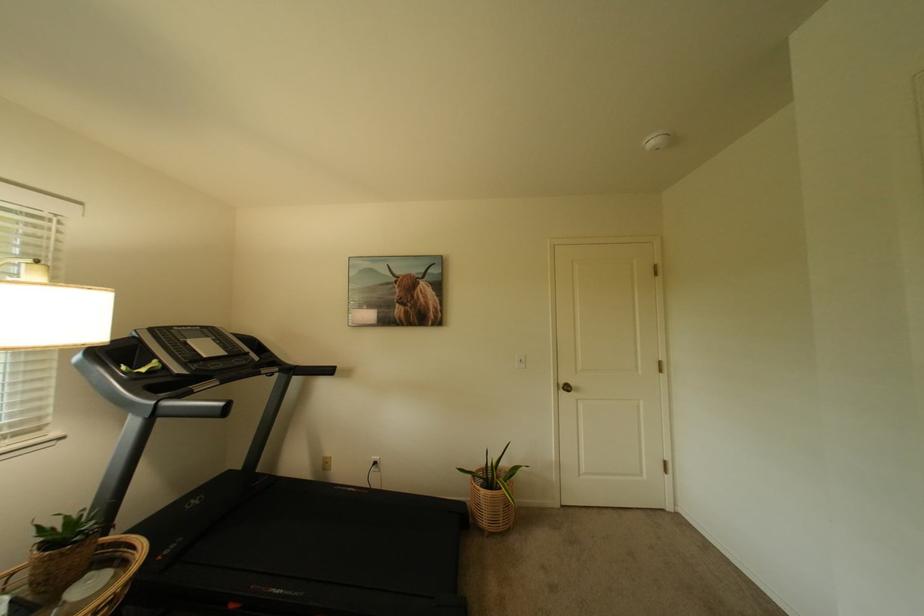
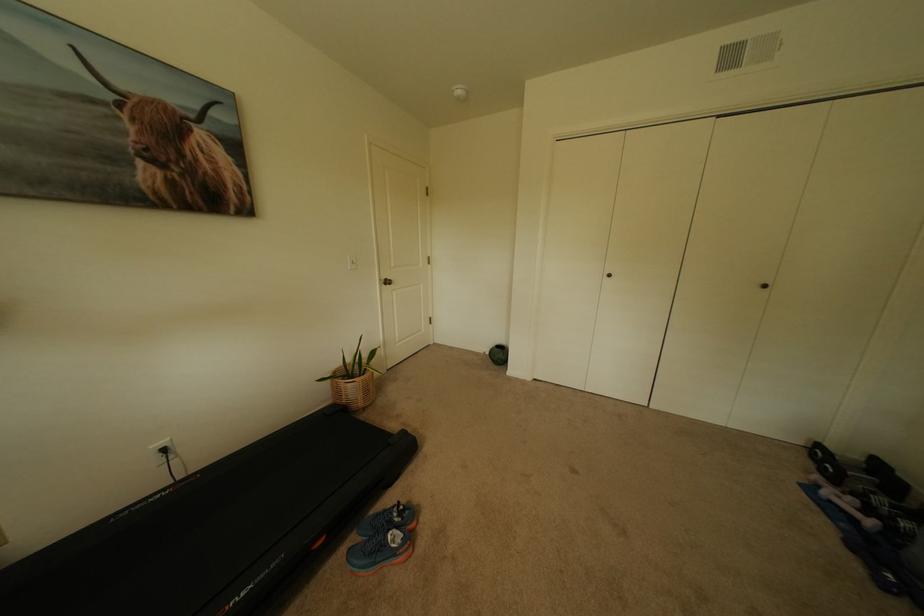
Where in the second image is the point corresponding to point 383,464 from the first image?

(173, 451)